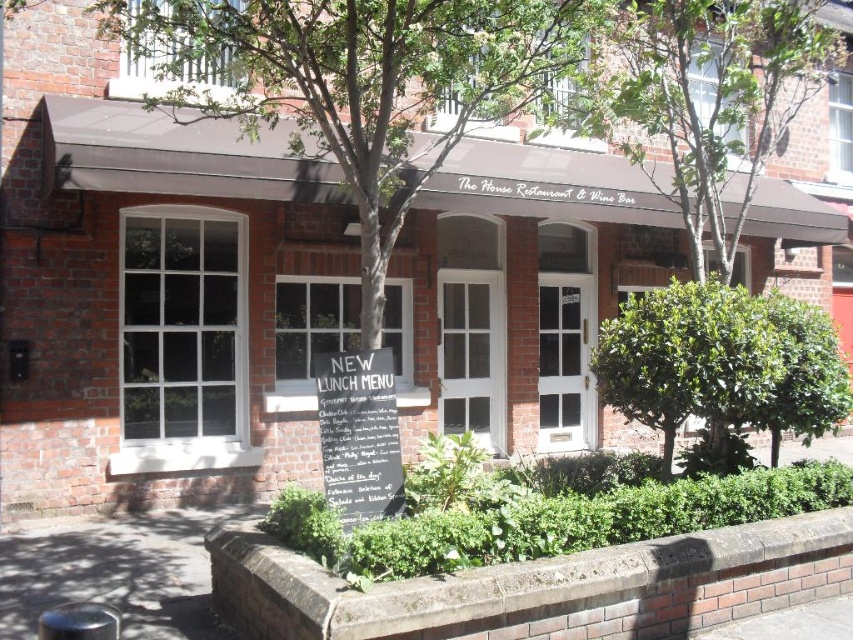
Looking at this image, you are a delivery person approaching the entrance of The House Restaurant. You need to see the white chalkboard sign at center clearly. Is the green leafy bush at center blocking your view of the sign?

The green leafy bush at center is taller than the white chalkboard sign at center, so it might block your view of the sign.